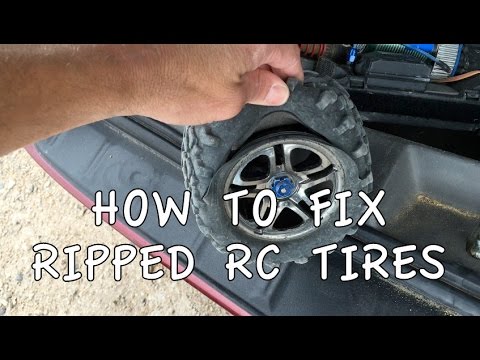
Where is `floor`? This screenshot has height=360, width=480. floor is located at coordinates [x=120, y=291].